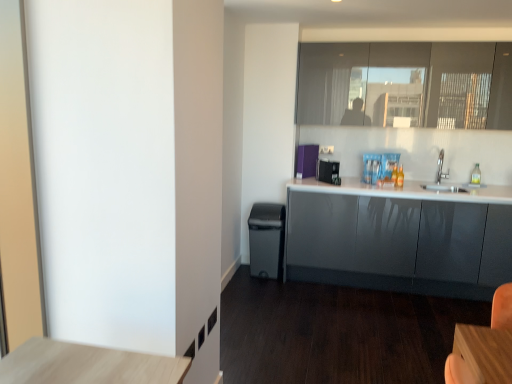
Question: Is transparent plastic bottle at right completely or partially inside black plastic toaster at center, the second appliance in the back-to-front sequence?

Choices:
 (A) yes
 (B) no

Answer: (B)

Question: Considering the relative sizes of black plastic toaster at center, the second appliance in the back-to-front sequence, and transparent plastic bottle at right in the image provided, is black plastic toaster at center, the second appliance in the back-to-front sequence, wider than transparent plastic bottle at right?

Choices:
 (A) no
 (B) yes

Answer: (B)

Question: Is black plastic toaster at center, the second appliance in the back-to-front sequence, behind transparent plastic bottle at right?

Choices:
 (A) no
 (B) yes

Answer: (A)

Question: Can you confirm if black plastic toaster at center, the first appliance viewed from the front, is taller than transparent plastic bottle at right?

Choices:
 (A) no
 (B) yes

Answer: (B)

Question: Does black plastic toaster at center, the second appliance in the back-to-front sequence, have a lesser width compared to transparent plastic bottle at right?

Choices:
 (A) yes
 (B) no

Answer: (B)

Question: In terms of height, does silver metallic sink at upper right look taller or shorter compared to purple fabric at upper center, positioned as the 2th appliance in front-to-back order?

Choices:
 (A) short
 (B) tall

Answer: (A)

Question: From the image's perspective, relative to purple fabric at upper center, which ranks as the 1th appliance in back-to-front order, is silver metallic sink at upper right above or below?

Choices:
 (A) above
 (B) below

Answer: (B)

Question: Choose the correct answer: Is silver metallic sink at upper right inside purple fabric at upper center, positioned as the 2th appliance in front-to-back order, or outside it?

Choices:
 (A) outside
 (B) inside

Answer: (A)

Question: Is silver metallic sink at upper right in front of or behind purple fabric at upper center, which ranks as the 1th appliance in back-to-front order, in the image?

Choices:
 (A) behind
 (B) front

Answer: (B)

Question: Considering the positions of matte black trash can at lower center and matte glass window at upper right in the image, is matte black trash can at lower center taller or shorter than matte glass window at upper right?

Choices:
 (A) short
 (B) tall

Answer: (A)

Question: Is point (279, 233) closer or farther from the camera than point (499, 122)?

Choices:
 (A) farther
 (B) closer

Answer: (A)

Question: From the image's perspective, is matte black trash can at lower center positioned above or below matte glass window at upper right?

Choices:
 (A) above
 (B) below

Answer: (B)

Question: Is matte black trash can at lower center wider or thinner than matte glass window at upper right?

Choices:
 (A) wide
 (B) thin

Answer: (B)

Question: Does point (466, 218) appear closer or farther from the camera than point (271, 253)?

Choices:
 (A) closer
 (B) farther

Answer: (A)

Question: In the image, is glossy gray cabinets at right positioned in front of or behind matte black trash can at lower center?

Choices:
 (A) front
 (B) behind

Answer: (A)